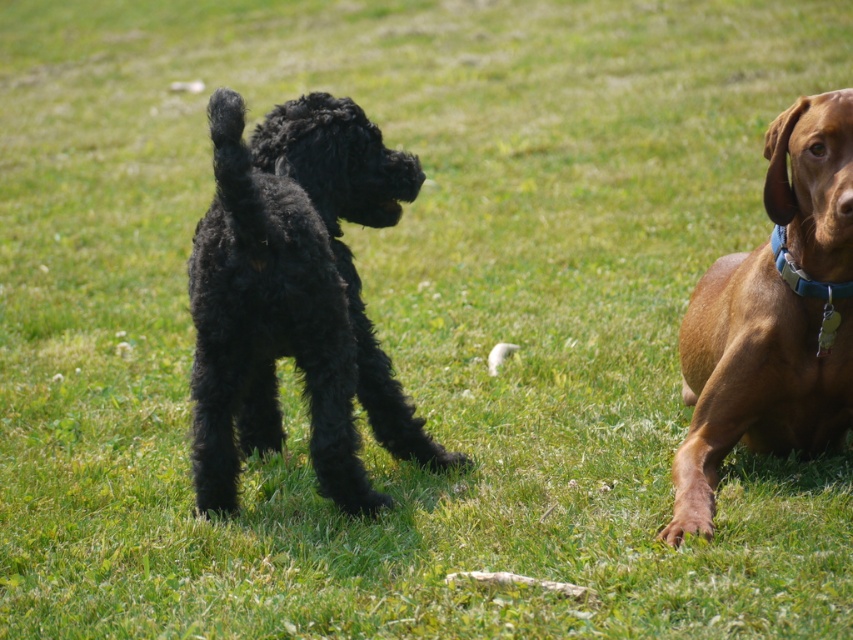
Question: Which of the following is the closest to the observer?

Choices:
 (A) (827, 292)
 (B) (274, 282)

Answer: (B)

Question: Is brown smooth dog at right positioned in front of blue fabric collar at right?

Choices:
 (A) yes
 (B) no

Answer: (A)

Question: Which point is closer to the camera?

Choices:
 (A) blue fabric collar at right
 (B) black fluffy dog at center
 (C) brown smooth dog at right

Answer: (C)

Question: Is brown smooth dog at right below blue fabric collar at right?

Choices:
 (A) yes
 (B) no

Answer: (A)

Question: Does black fluffy dog at center appear over blue fabric collar at right?

Choices:
 (A) no
 (B) yes

Answer: (A)

Question: Which of the following is the farthest from the observer?

Choices:
 (A) (701, 477)
 (B) (373, 177)
 (C) (788, 275)

Answer: (B)